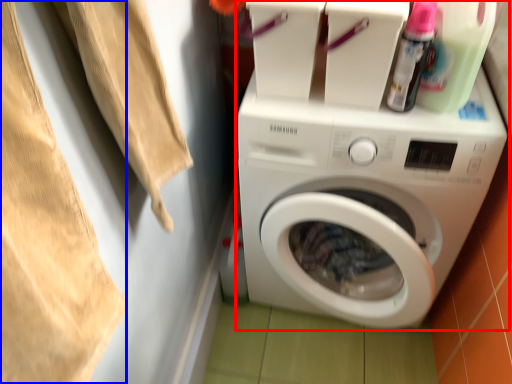
Question: Which object is further to the camera taking this photo, washing machine (highlighted by a red box) or clothing (highlighted by a blue box)?

Choices:
 (A) washing machine
 (B) clothing

Answer: (A)